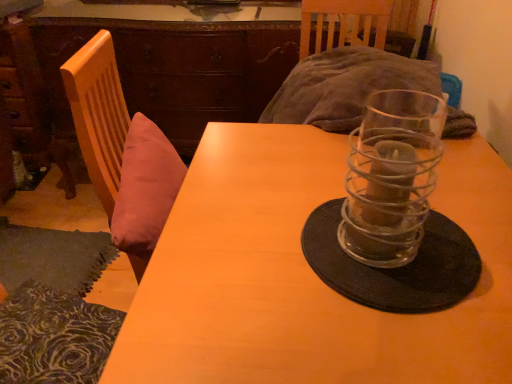
The height and width of the screenshot is (384, 512). What are the coordinates of `vacant space situated on the left part of black matte glass plate at center` in the screenshot? It's located at point(234,256).